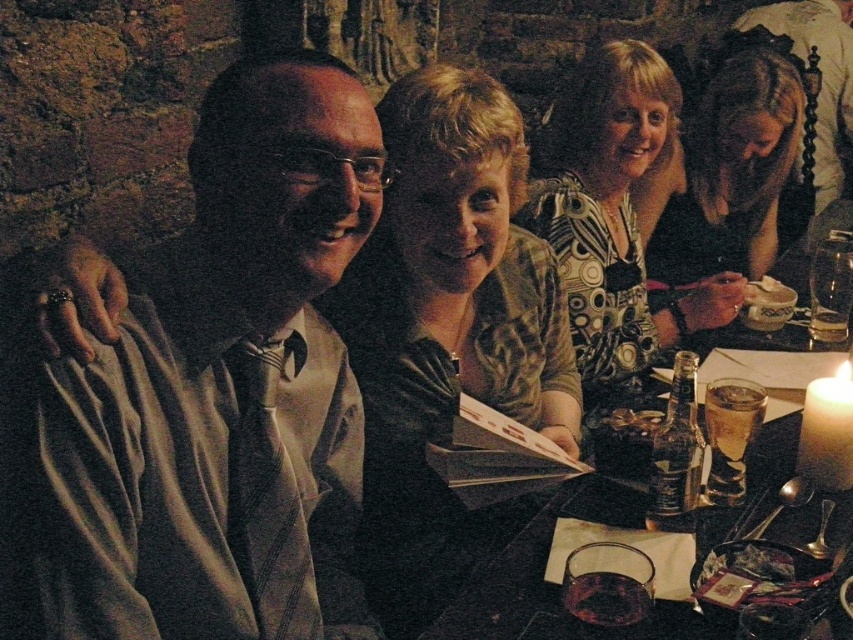
Does translucent glass bottle at table center appear on the left side of translucent glass at table right?

Correct, you'll find translucent glass bottle at table center to the left of translucent glass at table right.

Which is behind, point (700, 467) or point (840, 333)?

The point (840, 333) is more distant.

In order to click on translucent glass bottle at table center in this screenshot , I will do `click(676, 451)`.

Between clear glass wine glass at right and translucent glass at lower center, which one is positioned lower?

Positioned lower is translucent glass at lower center.

From the picture: Who is more distant from viewer, (834, 253) or (641, 612)?

The point (834, 253) is more distant.

At what (x,y) coordinates should I click in order to perform the action: click on clear glass wine glass at right. Please return your answer as a coordinate pair (x, y). Image resolution: width=853 pixels, height=640 pixels. Looking at the image, I should click on click(830, 285).

Does clear glass wine glass at lower right have a lesser width compared to translucent glass at lower center?

In fact, clear glass wine glass at lower right might be wider than translucent glass at lower center.

From the picture: Does clear glass wine glass at lower right have a larger size compared to translucent glass at lower center?

Yes.

Does point (740, 480) come farther from viewer compared to point (639, 602)?

Yes, it is behind point (639, 602).

What are the coordinates of `clear glass wine glass at lower right` in the screenshot? It's located at (730, 435).